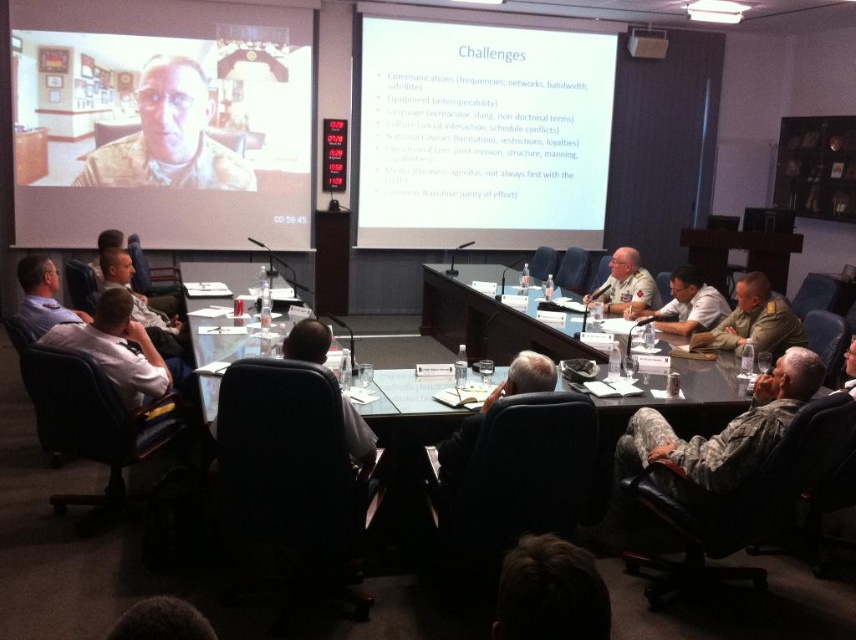
Can you confirm if matte black screen at upper left is bigger than camouflage uniform at center?

Yes, matte black screen at upper left is bigger than camouflage uniform at center.

Locate an element on the screen. This screenshot has height=640, width=856. matte black screen at upper left is located at coordinates (x=161, y=122).

Which is above, camouflage uniform at lower right or camouflage uniform at center?

camouflage uniform at center is higher up.

Who is taller, camouflage uniform at lower right or camouflage uniform at center?

Standing taller between the two is camouflage uniform at lower right.

This screenshot has height=640, width=856. Describe the element at coordinates (718, 435) in the screenshot. I see `camouflage uniform at lower right` at that location.

What are the coordinates of `camouflage uniform at lower right` in the screenshot? It's located at (718, 435).

Find the location of a particular element. This screenshot has height=640, width=856. camouflage uniform at lower right is located at coordinates (718, 435).

Does camouflage uniform at lower right appear under matte black uniform at upper left?

Indeed, camouflage uniform at lower right is positioned under matte black uniform at upper left.

Does point (652, 426) come in front of point (126, 179)?

Yes, point (652, 426) is in front of point (126, 179).

Locate an element on the screen. This screenshot has width=856, height=640. camouflage uniform at lower right is located at coordinates (718, 435).